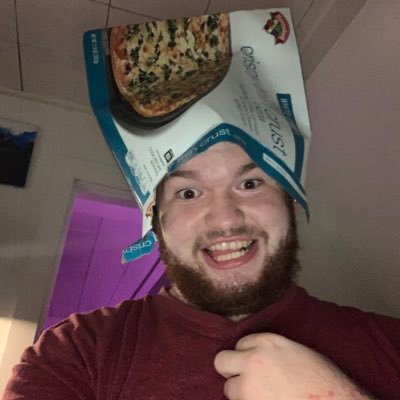
Identify the location of wall. The width and height of the screenshot is (400, 400). (350, 236), (30, 249).